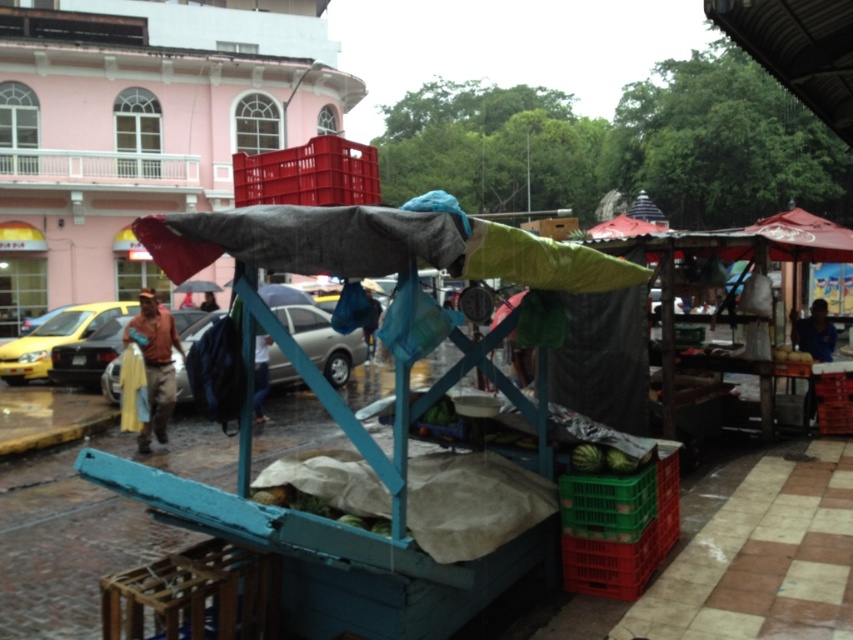
Is point (329, 358) less distant than point (163, 392)?

No, it is behind (163, 392).

Does metallic silver car at center appear over brown leather jacket at left?

Yes.

Does point (109, 390) come farther from viewer compared to point (152, 401)?

That is True.

The height and width of the screenshot is (640, 853). In order to click on metallic silver car at center in this screenshot , I will do `click(322, 340)`.

Is matte plastic crate at upper center to the left of metallic silver car at left from the viewer's perspective?

In fact, matte plastic crate at upper center is to the right of metallic silver car at left.

Is point (286, 156) closer to viewer compared to point (82, 362)?

Yes, it is in front of point (82, 362).

Where is `matte plastic crate at upper center`? The width and height of the screenshot is (853, 640). matte plastic crate at upper center is located at coordinates (308, 173).

Who is positioned more to the right, yellow matte taxi at left or brown leather jacket at center?

brown leather jacket at center

Is yellow matte taxi at left wider than brown leather jacket at center?

Yes.

Who is more forward, (131, 301) or (206, 308)?

Point (131, 301) is more forward.

Image resolution: width=853 pixels, height=640 pixels. What are the coordinates of `yellow matte taxi at left` in the screenshot? It's located at (55, 339).